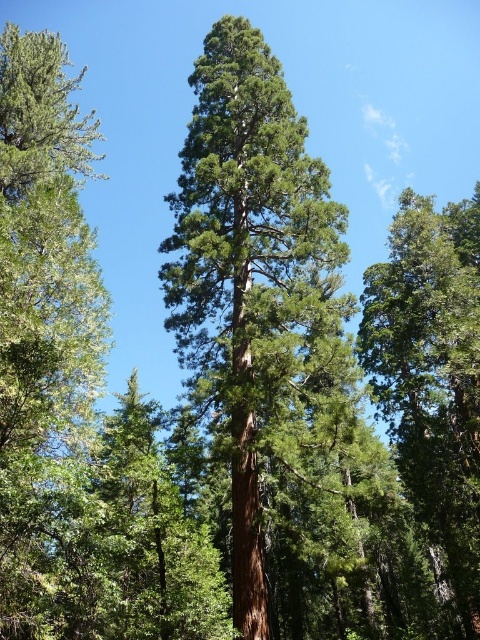
You are a hiker trying to navigate through the forest and need to identify the tallest tree to use as a landmark. Which tree should you choose between the green rough bark tree at center and the green matte tree at left?

The green rough bark tree at center is taller than the green matte tree at left, so you should choose the green rough bark tree at center as your landmark.

You are a nature photographer standing in a forest. You want to capture a photo of the green rough bark tree at center. If your camera has a focal length of 50mm and you are currently 9.63 meters away from the tree, what adjustment should you make to frame the tree properly in your shot?

The green rough bark tree at center is currently 9.63 meters away from the camera. To frame it properly, you might need to move closer or use a longer focal length to ensure the tree fills the frame appropriately.

You are a hiker who wants to find the tallest tree in this forest. Based on the trees you can see, which one is taller between the green matte tree at left and the green matte tree at center?

The green matte tree at left is taller than the green matte tree at center.